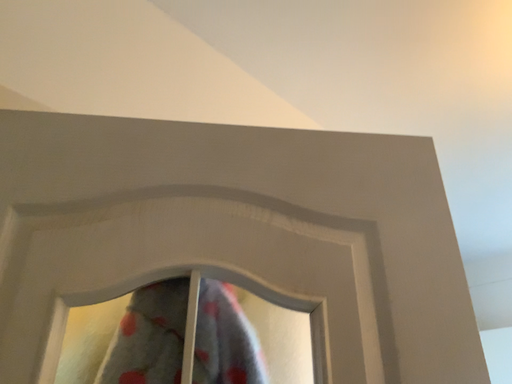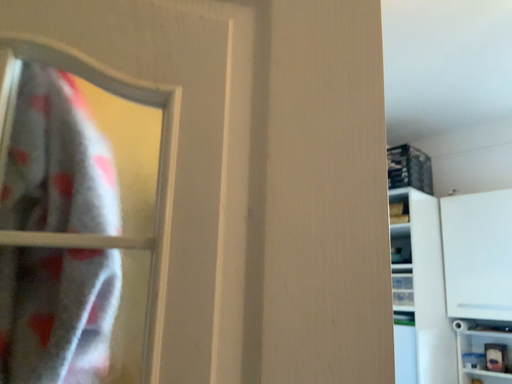
Question: Which way did the camera rotate in the video?

Choices:
 (A) rotated upward
 (B) rotated downward

Answer: (B)